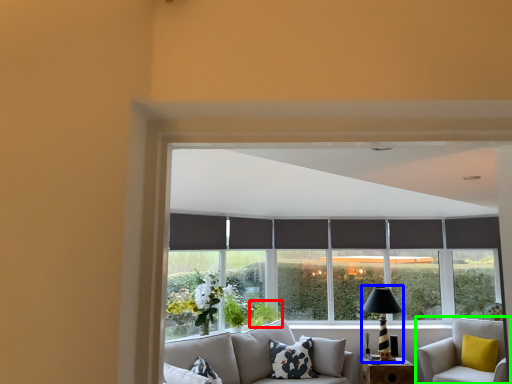
Question: Considering the real-world distances, which object is farthest from plant (highlighted by a red box)? table lamp (highlighted by a blue box) or studio couch (highlighted by a green box)?

Choices:
 (A) table lamp
 (B) studio couch

Answer: (B)